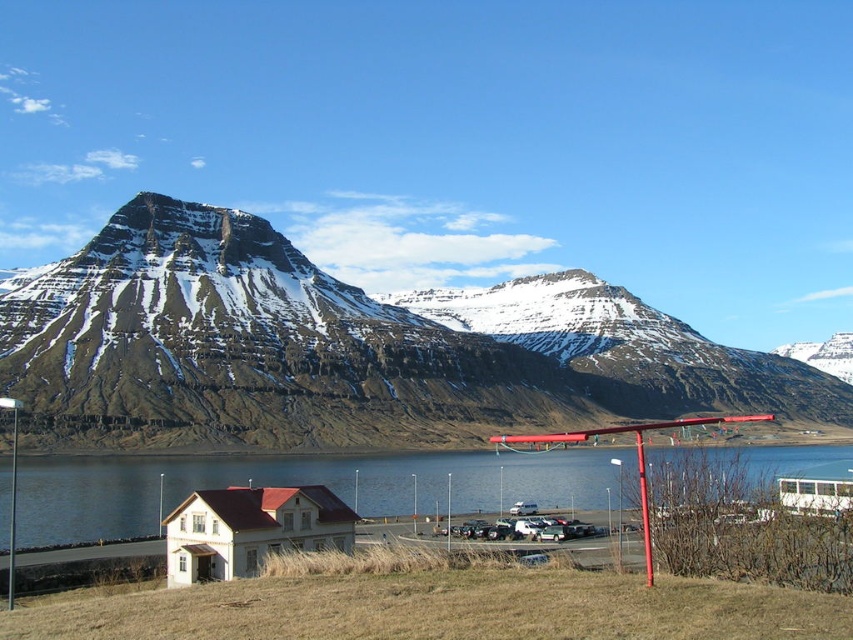
Question: Which of these objects is positioned farthest from the blue water at lower center?

Choices:
 (A) metallic silver car at center
 (B) snowy rock mountain at upper center

Answer: (B)

Question: Does snowy rock mountain at upper center have a smaller size compared to blue water at lower center?

Choices:
 (A) no
 (B) yes

Answer: (A)

Question: Is snowy rock mountain at upper center thinner than blue water at lower center?

Choices:
 (A) yes
 (B) no

Answer: (B)

Question: Which object is positioned farthest from the metallic silver car at center?

Choices:
 (A) blue water at lower center
 (B) snowy rock mountain at upper center

Answer: (B)

Question: Which object appears closest to the camera in this image?

Choices:
 (A) snowy rock mountain at upper center
 (B) metallic silver car at center
 (C) blue water at lower center

Answer: (C)

Question: Can you confirm if snowy rock mountain at upper center is thinner than blue water at lower center?

Choices:
 (A) no
 (B) yes

Answer: (A)